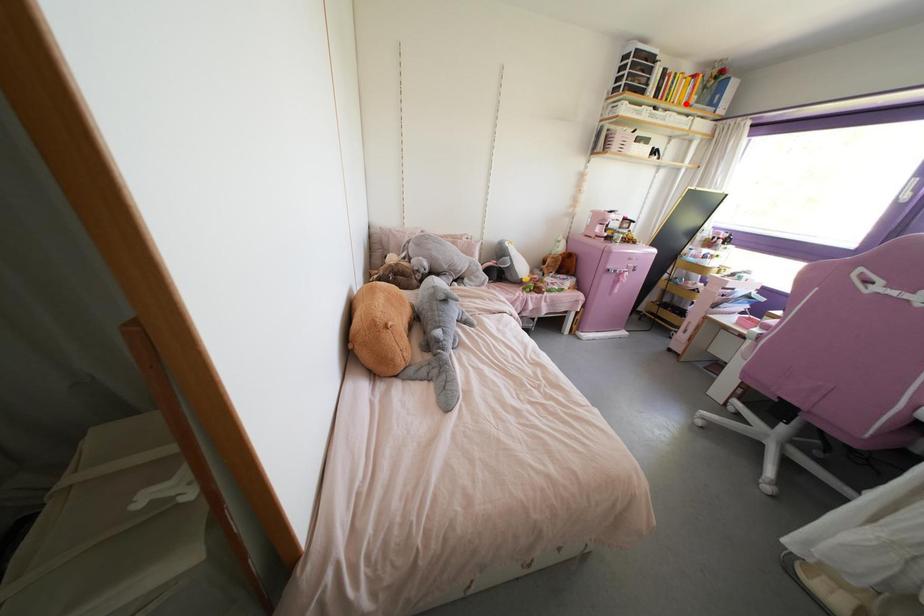
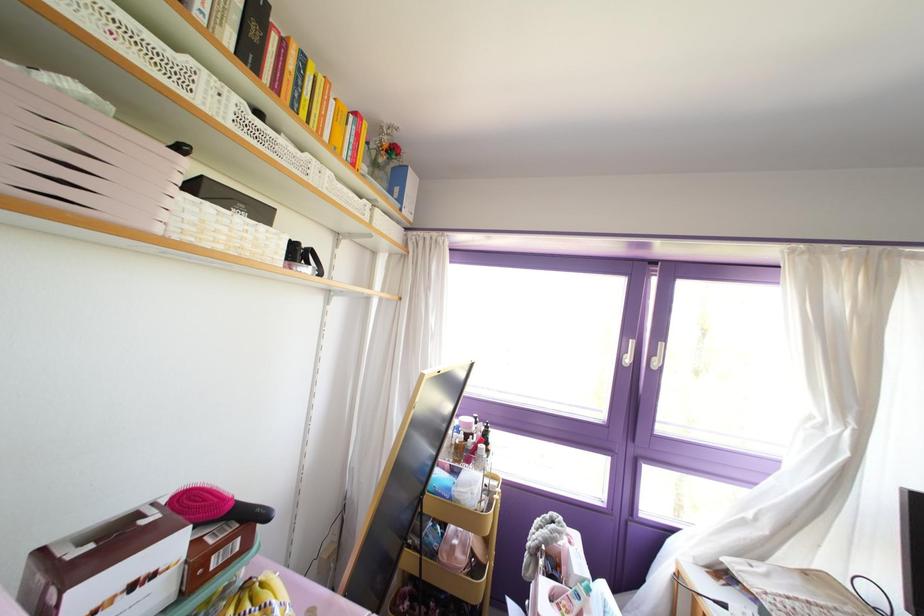
The point at the highlighted location is marked in the first image. Where is the corresponding point in the second image?

(351, 164)